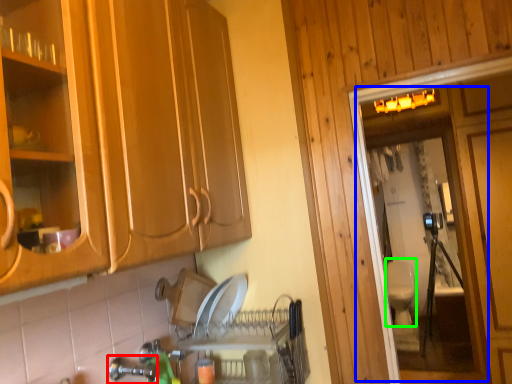
Question: Which object is the closest to the faucet (highlighted by a red box)? Choose among these: screen door (highlighted by a blue box) or toilet bowl (highlighted by a green box).

Choices:
 (A) screen door
 (B) toilet bowl

Answer: (A)